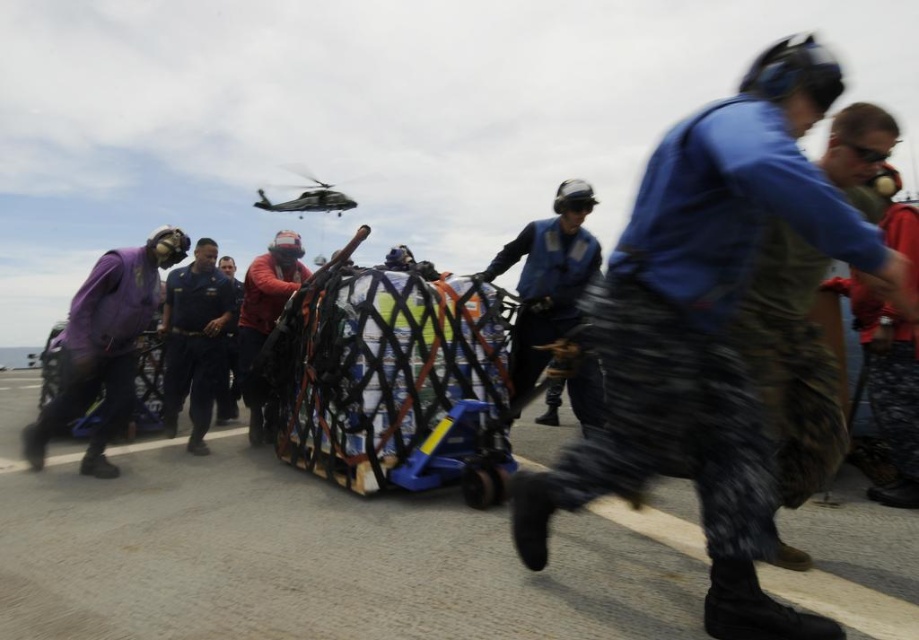
Question: Which object is positioned farthest from the blue uniform at center?

Choices:
 (A) camo fabric uniform at center
 (B) red fabric bag at center

Answer: (A)

Question: Which point appears farthest from the camera in this image?

Choices:
 (A) (245, 371)
 (B) (210, 349)

Answer: (B)

Question: Can you confirm if smooth concrete tarmac at center is thinner than purple fabric at left?

Choices:
 (A) yes
 (B) no

Answer: (B)

Question: Considering the relative positions of blue fabric vest at center and red fabric bag at center in the image provided, where is blue fabric vest at center located with respect to red fabric bag at center?

Choices:
 (A) left
 (B) right

Answer: (B)

Question: Is purple fabric at left below blue fabric vest at center?

Choices:
 (A) yes
 (B) no

Answer: (A)

Question: Which point is closer to the camera?

Choices:
 (A) (287, 230)
 (B) (214, 340)

Answer: (A)